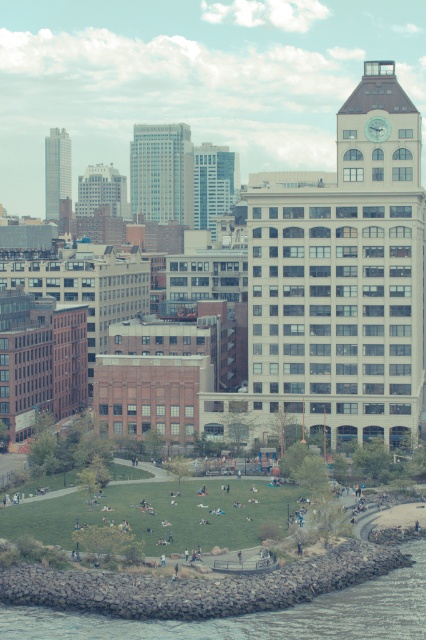
Is white smooth building at right above smooth glass skyscraper at center?

Actually, white smooth building at right is below smooth glass skyscraper at center.

Does white smooth building at right have a smaller size compared to smooth glass skyscraper at center?

Incorrect, white smooth building at right is not smaller in size than smooth glass skyscraper at center.

The height and width of the screenshot is (640, 426). I want to click on white smooth building at right, so click(x=345, y=269).

Is white smooth building at right smaller than gray rock wall at lower left?

Incorrect, white smooth building at right is not smaller in size than gray rock wall at lower left.

This screenshot has height=640, width=426. What do you see at coordinates (345, 269) in the screenshot?
I see `white smooth building at right` at bounding box center [345, 269].

Where is `white smooth building at right`? This screenshot has height=640, width=426. white smooth building at right is located at coordinates (345, 269).

What are the coordinates of `white smooth building at right` in the screenshot? It's located at (345, 269).

Can you confirm if white smooth building at right is wider than white glass building at center?

Yes.

Can you confirm if white smooth building at right is bigger than white glass building at center?

No.

Which is behind, point (293, 362) or point (193, 173)?

Positioned behind is point (193, 173).

This screenshot has width=426, height=640. I want to click on white smooth building at right, so click(345, 269).